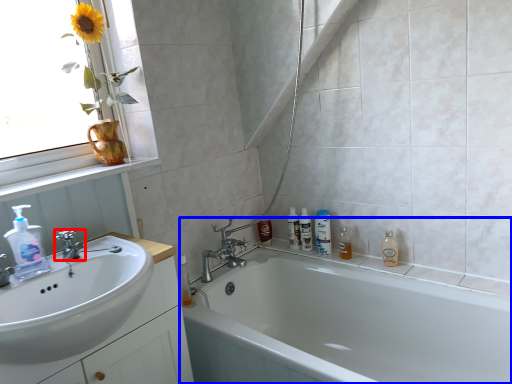
Question: Which object is further to the camera taking this photo, tap (highlighted by a red box) or bathtub (highlighted by a blue box)?

Choices:
 (A) tap
 (B) bathtub

Answer: (A)